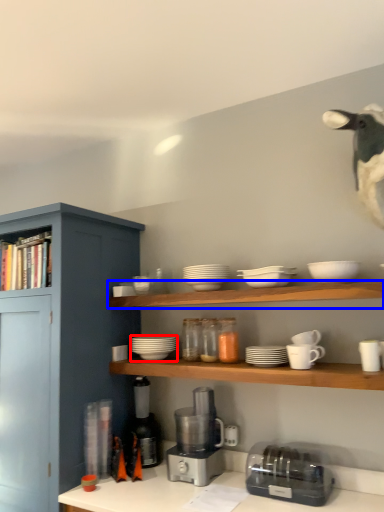
Question: Which of the following is the farthest to the observer, tableware (highlighted by a red box) or shelf (highlighted by a blue box)?

Choices:
 (A) tableware
 (B) shelf

Answer: (A)